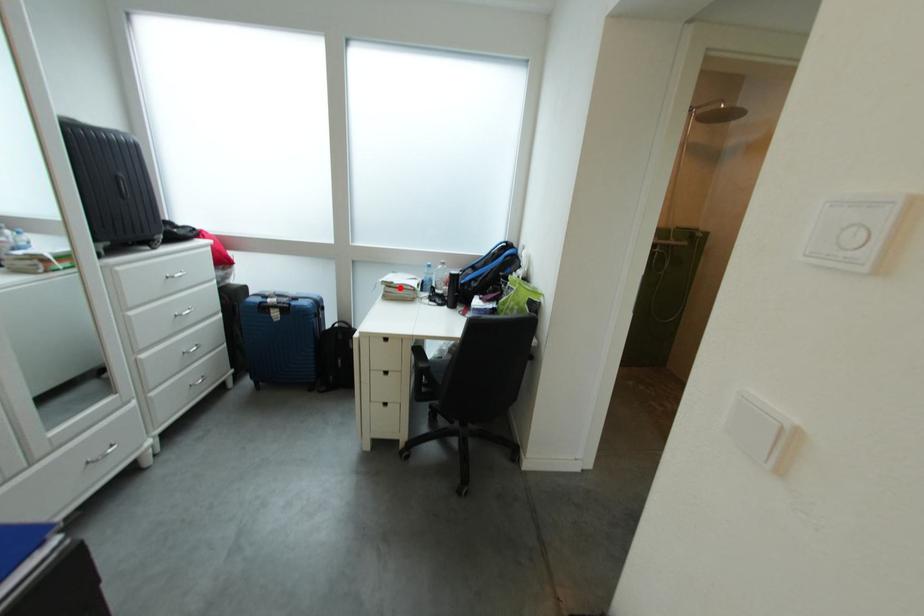
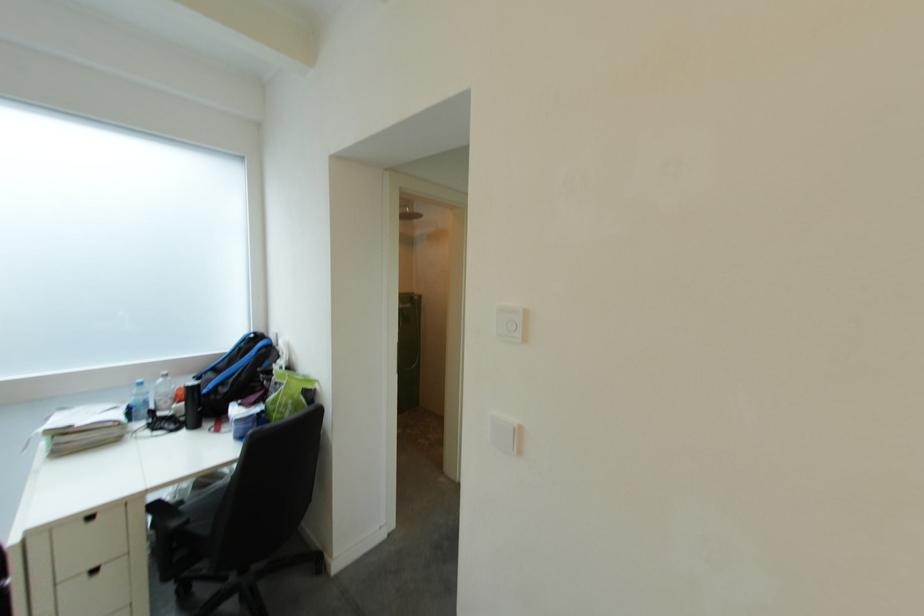
Where in the second image is the point corresponding to the highlighted location from the first image?

(73, 436)